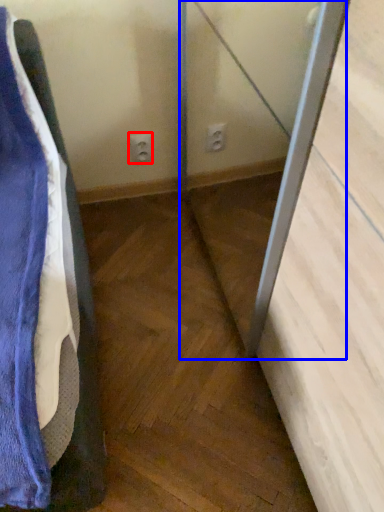
Question: Among these objects, which one is nearest to the camera, electric outlet (highlighted by a red box) or screen door (highlighted by a blue box)?

Choices:
 (A) electric outlet
 (B) screen door

Answer: (B)